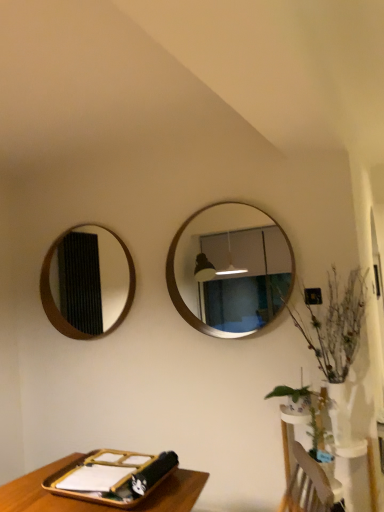
Question: Does white glossy vase at lower right have a greater height compared to wooden framed mirror at center, the second mirror viewed from the back?

Choices:
 (A) yes
 (B) no

Answer: (B)

Question: Considering the relative sizes of white glossy vase at lower right and wooden framed mirror at center, placed as the 1th mirror when sorted from right to left, in the image provided, is white glossy vase at lower right shorter than wooden framed mirror at center, placed as the 1th mirror when sorted from right to left,?

Choices:
 (A) yes
 (B) no

Answer: (A)

Question: Considering the relative sizes of white glossy vase at lower right and wooden framed mirror at center, arranged as the first mirror when viewed from the front, in the image provided, is white glossy vase at lower right bigger than wooden framed mirror at center, arranged as the first mirror when viewed from the front,?

Choices:
 (A) yes
 (B) no

Answer: (A)

Question: From a real-world perspective, is white glossy vase at lower right beneath wooden framed mirror at center, the second mirror viewed from the back?

Choices:
 (A) no
 (B) yes

Answer: (B)

Question: Considering the relative positions of white glossy vase at lower right and wooden framed mirror at center, placed as the 1th mirror when sorted from right to left, in the image provided, is white glossy vase at lower right in front of wooden framed mirror at center, placed as the 1th mirror when sorted from right to left,?

Choices:
 (A) no
 (B) yes

Answer: (B)

Question: Does white glossy vase at lower right appear on the left side of wooden framed mirror at center, the second mirror viewed from the back?

Choices:
 (A) yes
 (B) no

Answer: (B)

Question: Considering the relative sizes of green matte plant at lower right and green leafy plant at right in the image provided, is green matte plant at lower right wider than green leafy plant at right?

Choices:
 (A) no
 (B) yes

Answer: (B)

Question: Is green matte plant at lower right oriented away from green leafy plant at right?

Choices:
 (A) no
 (B) yes

Answer: (B)

Question: Does green matte plant at lower right come in front of green leafy plant at right?

Choices:
 (A) no
 (B) yes

Answer: (A)

Question: Does green matte plant at lower right have a smaller size compared to green leafy plant at right?

Choices:
 (A) yes
 (B) no

Answer: (A)

Question: Does green matte plant at lower right have a greater height compared to green leafy plant at right?

Choices:
 (A) yes
 (B) no

Answer: (B)

Question: From the image's perspective, is green matte plant at lower right on green leafy plant at right?

Choices:
 (A) yes
 (B) no

Answer: (B)

Question: Is green leafy plant at right shorter than white glossy vase at lower right?

Choices:
 (A) no
 (B) yes

Answer: (A)